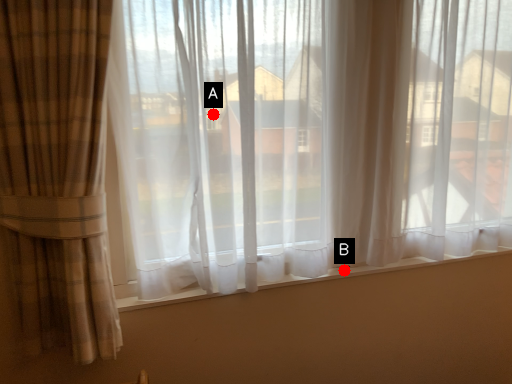
Question: Two points are circled on the image, labeled by A and B beside each circle. Which point is further to the camera?

Choices:
 (A) A is further
 (B) B is further

Answer: (B)